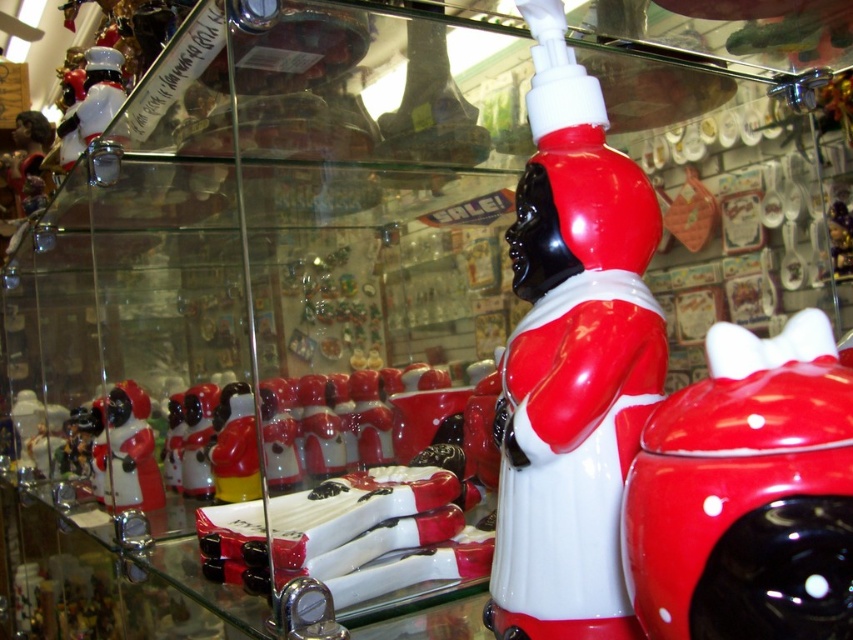
You are a customer in the store looking at the display case. You see two points marked in the image. Which point is closer to you, point (x=595, y=513) or point (x=96, y=61)?

Point (x=595, y=513) is in front of point (x=96, y=61), so it is closer to you.

You are a delivery person who needs to place a new item between the shiny ceramic santa at center and the shiny silver figurine at upper left. The item is 75 centimeters long. Will it fit in the space between them?

The distance between the shiny ceramic santa at center and the shiny silver figurine at upper left is 76.15 centimeters. Since the item is 75 centimeters long, it will fit with a small gap remaining.

You are a delivery person who needs to place a new box that is 15 inches wide into the display case. You see the matte plastic figurine at left and the shiny silver figurine at upper left. Can you fit the box between them?

The distance between the matte plastic figurine at left and the shiny silver figurine at upper left is 14.85 inches. Since the box is 15 inches wide, it cannot fit between them as the space is slightly narrower than the box.